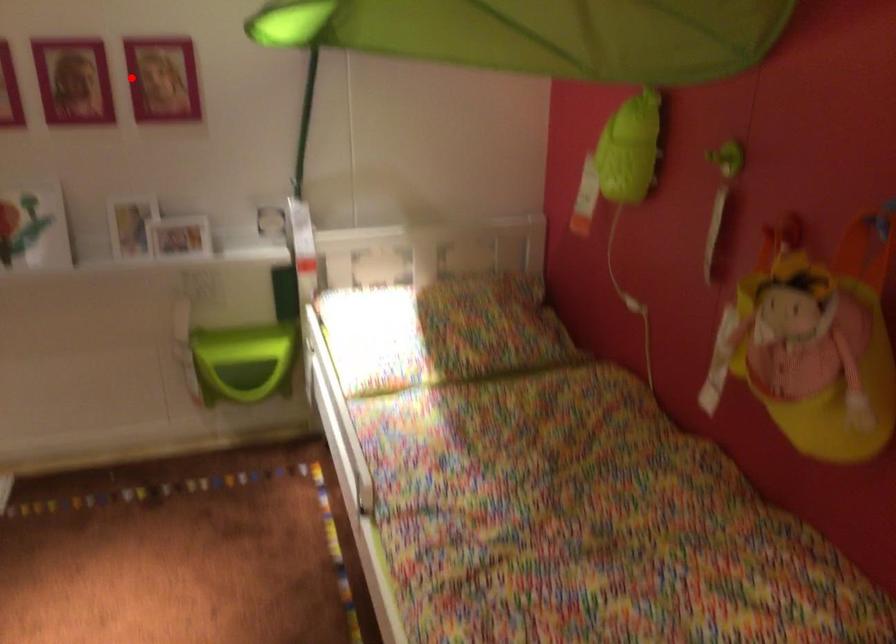
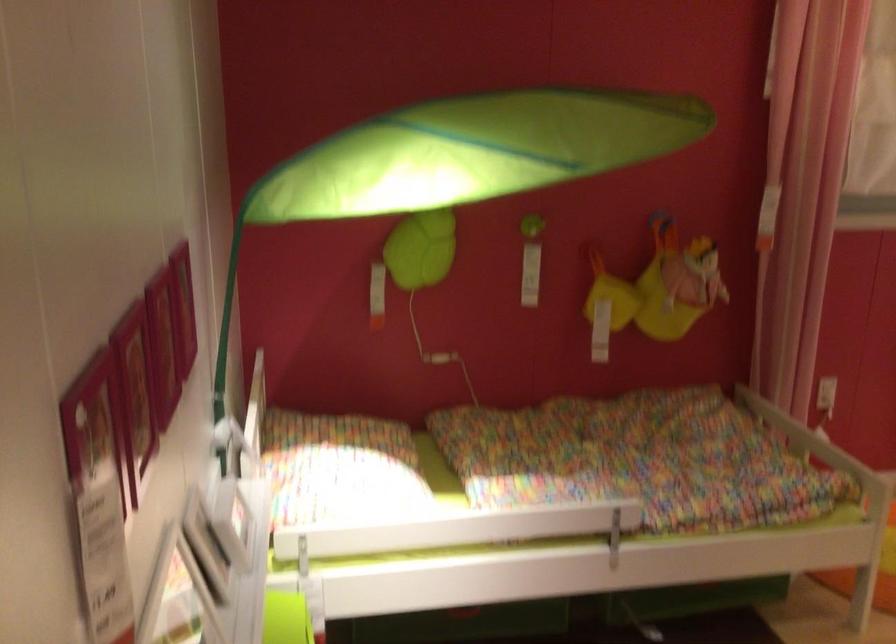
Question: I am providing you with two images of the same scene from different viewpoints. Given a red point in image1, look at the same physical point in image2. Is it:

Choices:
 (A) Closer to the viewpoint
 (B) Farther from the viewpoint

Answer: (A)